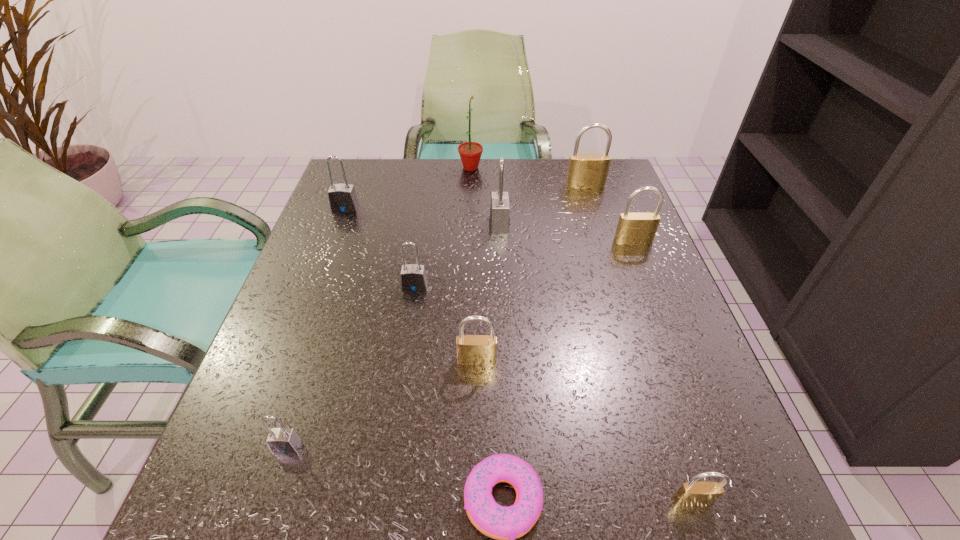
Identify the location of the fifth farthest padlock. The image size is (960, 540). (413, 276).

Where is `the eighth object from right to left`? the eighth object from right to left is located at coordinates (413, 276).

Identify the location of the leftmost brass padlock. This screenshot has height=540, width=960. (471, 349).

Where is `the sixth farthest padlock`? The width and height of the screenshot is (960, 540). the sixth farthest padlock is located at coordinates (471, 349).

Locate an element on the screen. the smallest gray padlock is located at coordinates (281, 440).

Where is `the nearest gray padlock`? the nearest gray padlock is located at coordinates (281, 440).

Identify the location of the nearest brass padlock. Image resolution: width=960 pixels, height=540 pixels. (692, 493).

Find the location of a particular element. The width and height of the screenshot is (960, 540). the smallest brass padlock is located at coordinates (692, 493).

At what (x,y) coordinates should I click in order to perform the action: click on free space located 0.140m on the face of the green sunflower. Please return your answer as a coordinate pair (x, y). This screenshot has height=540, width=960. Looking at the image, I should click on (531, 167).

Locate an element on the screen. The width and height of the screenshot is (960, 540). vacant area located 0.050m on the front-facing side of the farthest brass padlock is located at coordinates (589, 200).